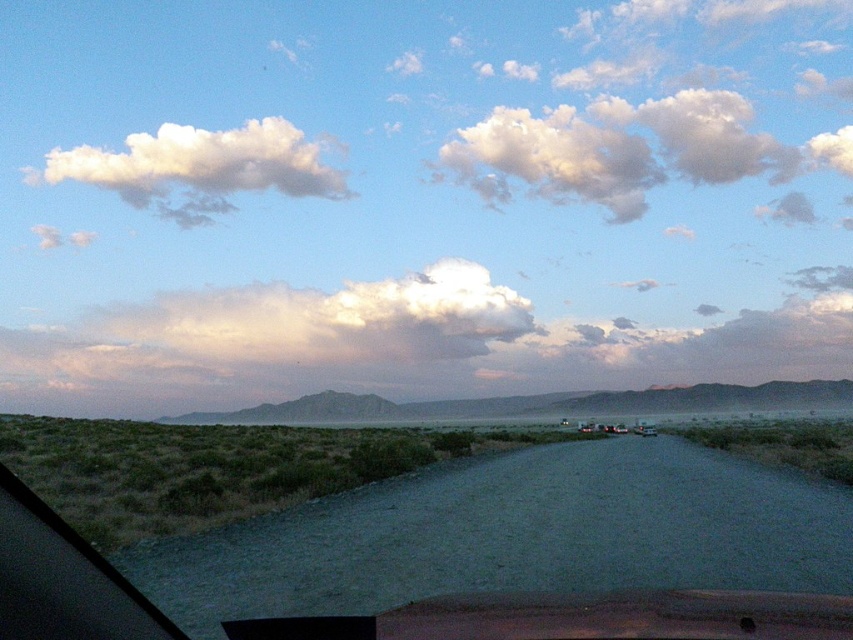
Question: Which object is the closest to the transparent glass car window at lower left?

Choices:
 (A) white fluffy cloud at upper center
 (B) white fluffy cloud at upper left

Answer: (B)

Question: Considering the real-world distances, which object is farthest from the white fluffy cloud at upper center?

Choices:
 (A) white fluffy cloud at upper left
 (B) transparent glass car window at lower left

Answer: (B)

Question: Is white fluffy cloud at upper left thinner than transparent glass car window at lower left?

Choices:
 (A) no
 (B) yes

Answer: (A)

Question: Estimate the real-world distances between objects in this image. Which object is farther from the white fluffy cloud at upper center?

Choices:
 (A) white fluffy cloud at upper left
 (B) transparent glass car window at lower left

Answer: (B)

Question: Where is white fluffy cloud at upper center located in relation to white fluffy cloud at upper left in the image?

Choices:
 (A) above
 (B) below

Answer: (A)

Question: Does white fluffy cloud at upper center have a lesser width compared to white fluffy cloud at upper left?

Choices:
 (A) no
 (B) yes

Answer: (A)